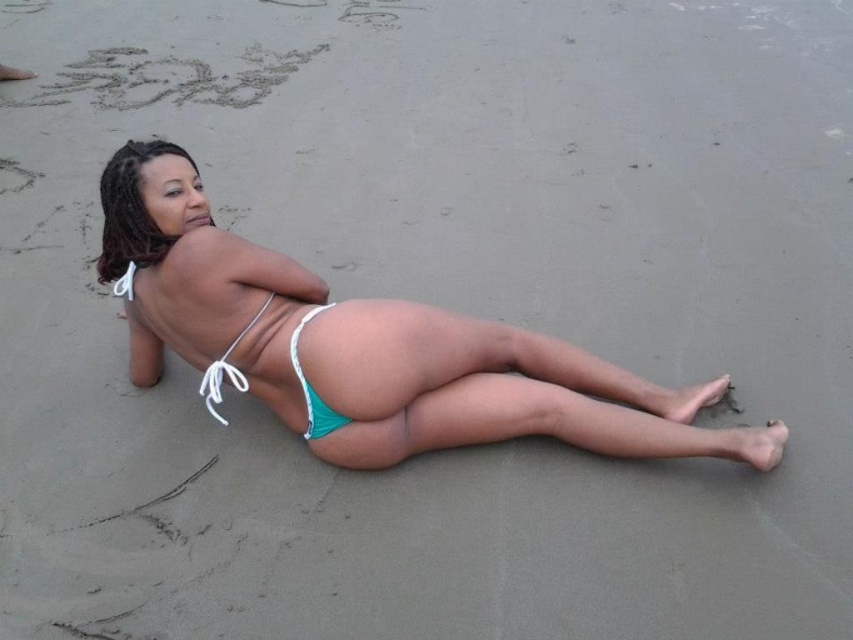
Question: Is teal fabric bikini bottom at center bigger than teal fabric bikini bottom at lower center?

Choices:
 (A) yes
 (B) no

Answer: (A)

Question: Can you confirm if teal fabric bikini bottom at center is thinner than teal fabric bikini bottom at lower center?

Choices:
 (A) no
 (B) yes

Answer: (A)

Question: Which is farther from the teal fabric bikini bottom at lower center?

Choices:
 (A) teal fabric bikini bottom at center
 (B) matte white bikini top at upper left

Answer: (B)

Question: Which of the following is the farthest from the observer?

Choices:
 (A) (229, 260)
 (B) (154, 252)

Answer: (B)

Question: Can you confirm if teal fabric bikini bottom at center is thinner than matte white bikini top at upper left?

Choices:
 (A) yes
 (B) no

Answer: (B)

Question: Estimate the real-world distances between objects in this image. Which object is farther from the teal fabric bikini bottom at lower center?

Choices:
 (A) teal fabric bikini bottom at center
 (B) matte white bikini top at upper left

Answer: (B)